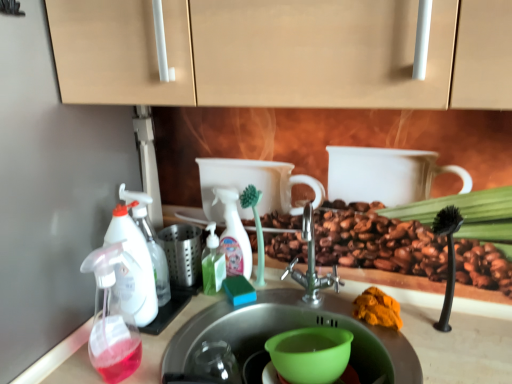
Question: From the image's perspective, is translucent plastic soap dispenser at left, positioned as the third soap dispenser in right-to-left order, located above or below green translucent soap dispenser at center, which appears as the third soap dispenser when viewed from the front?

Choices:
 (A) above
 (B) below

Answer: (A)

Question: From a real-world perspective, is translucent plastic soap dispenser at left, which ranks as the second soap dispenser in back-to-front order, above or below green translucent soap dispenser at center, which appears as the third soap dispenser when viewed from the front?

Choices:
 (A) above
 (B) below

Answer: (A)

Question: Considering the real-world distances, which object is farthest from the green plastic cup at sink?

Choices:
 (A) transparent plastic spray bottle at left, the 1th sink ordered from the bottom
 (B) stainless steel sink at center, which is the second sink from bottom to top
 (C) orange powder at sink
 (D) translucent plastic spray bottle at center
 (E) translucent plastic spray bottle at left, the first soap dispenser positioned from the front

Answer: (E)

Question: Based on their relative distances, which object is nearer to the orange powder at sink?

Choices:
 (A) green plastic cup at sink
 (B) translucent plastic spray bottle at center
 (C) translucent plastic spray bottle at left, the 2th soap dispenser when ordered from right to left
 (D) translucent plastic soap dispenser at left, which appears as the 2th soap dispenser when viewed from the front
 (E) transparent plastic spray bottle at left, the 1th sink ordered from the bottom

Answer: (A)